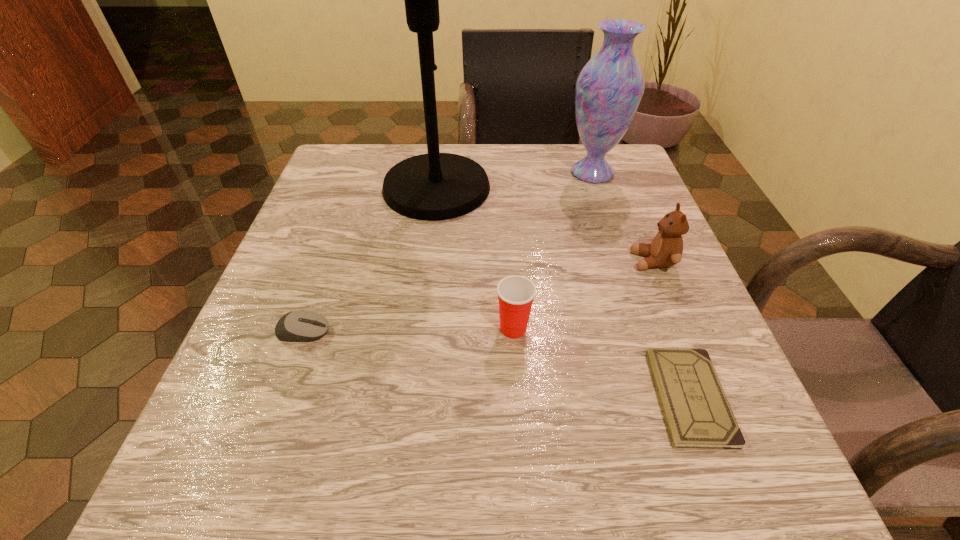
Identify the location of table lamp located in the left edge section of the desktop. The width and height of the screenshot is (960, 540). (435, 186).

Find the location of a particular element. computer equipment that is at the left edge is located at coordinates (297, 326).

Where is `vase present at the right edge`? vase present at the right edge is located at coordinates click(609, 88).

What are the coordinates of `teddy bear that is at the right edge` in the screenshot? It's located at (666, 248).

The height and width of the screenshot is (540, 960). Find the location of `checkbook located at the right edge`. checkbook located at the right edge is located at coordinates (697, 413).

This screenshot has height=540, width=960. In order to click on object located at the far left corner in this screenshot , I will do 435,186.

Locate an element on the screen. object present at the far right corner is located at coordinates (609, 88).

This screenshot has height=540, width=960. In order to click on object that is positioned at the near right corner in this screenshot , I will do `click(697, 413)`.

Locate an element on the screen. The height and width of the screenshot is (540, 960). vacant space at the far edge of the desktop is located at coordinates point(452,149).

This screenshot has height=540, width=960. What are the coordinates of `vacant position at the near edge of the desktop` in the screenshot? It's located at (407, 475).